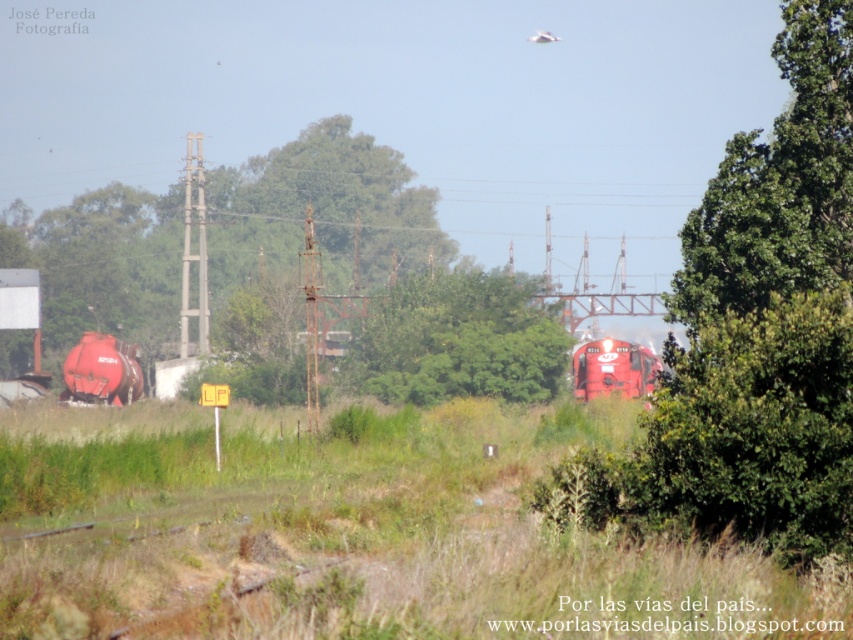
Measure the distance between matte red tank car at left and camera.

matte red tank car at left is 76.88 meters away from camera.

Identify the location of matte red tank car at left. This screenshot has height=640, width=853. (102, 371).

Between green leafy tree at center and matte red tank car at left, which one appears on the right side from the viewer's perspective?

green leafy tree at center

Can you confirm if green leafy tree at center is taller than matte red tank car at left?

Indeed, green leafy tree at center has a greater height compared to matte red tank car at left.

This screenshot has width=853, height=640. What do you see at coordinates (459, 339) in the screenshot?
I see `green leafy tree at center` at bounding box center [459, 339].

Find the location of a particular element. green leafy tree at center is located at coordinates (459, 339).

Identify the location of green leafy tree at center. pyautogui.click(x=459, y=339).

Where is `green leafy tree at center`? green leafy tree at center is located at coordinates (459, 339).